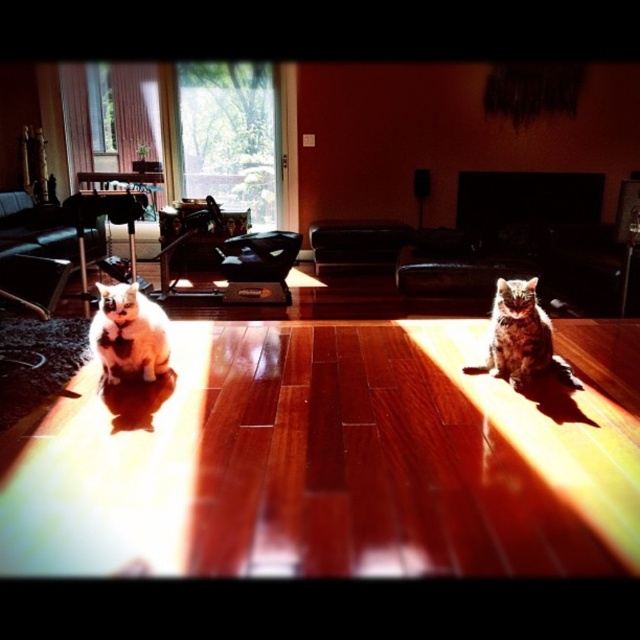
Can you confirm if white fluffy cat at left is thinner than tabby fur cat at center?

Correct, white fluffy cat at left's width is less than tabby fur cat at center's.

Who is higher up, white fluffy cat at left or tabby fur cat at center?

white fluffy cat at left is higher up.

What do you see at coordinates (129, 333) in the screenshot? The height and width of the screenshot is (640, 640). I see `white fluffy cat at left` at bounding box center [129, 333].

This screenshot has height=640, width=640. Find the location of `white fluffy cat at left`. white fluffy cat at left is located at coordinates (129, 333).